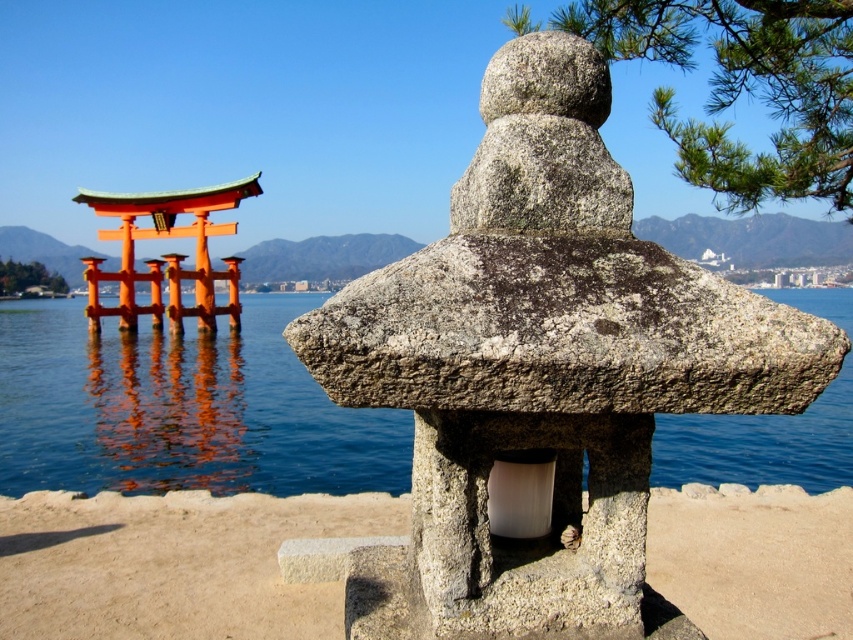
Question: Does gray stone lantern at center appear on the left side of orange painted wood torii gate at left?

Choices:
 (A) no
 (B) yes

Answer: (A)

Question: Based on their relative distances, which object is farther from the gray stone lantern at center?

Choices:
 (A) smooth concrete base at center
 (B) orange painted wood torii gate at left

Answer: (B)

Question: Which point is farther from the camera taking this photo?

Choices:
 (A) (148, 593)
 (B) (123, 227)
 (C) (505, 288)
 (D) (244, 372)

Answer: (B)

Question: Which point is farther to the camera?

Choices:
 (A) (293, 380)
 (B) (450, 588)
 (C) (323, 508)
 (D) (157, 282)

Answer: (D)

Question: Is smooth concrete base at center in front of orange painted wood torii gate at left?

Choices:
 (A) no
 (B) yes

Answer: (B)

Question: Is blue water at center above smooth concrete base at center?

Choices:
 (A) yes
 (B) no

Answer: (A)